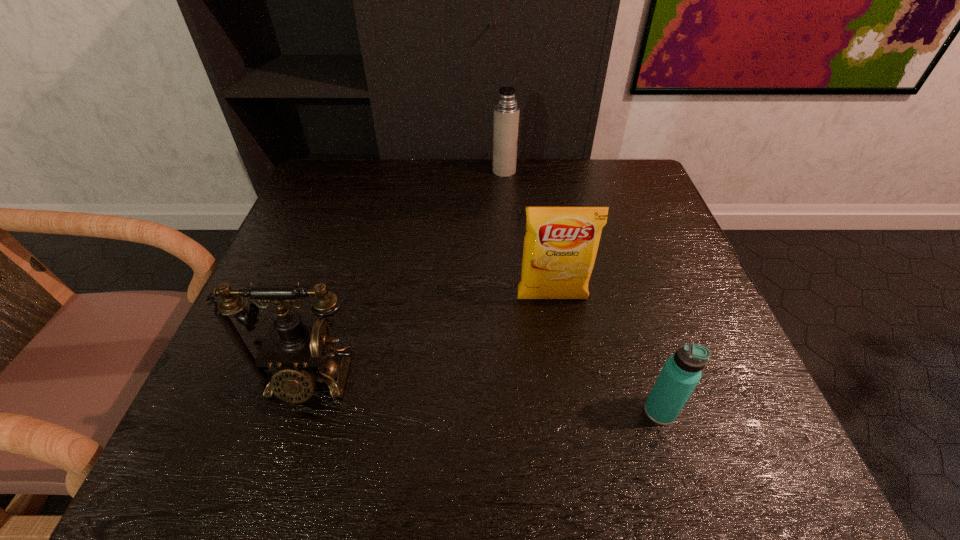
Where is `object that is at the far edge`? The width and height of the screenshot is (960, 540). object that is at the far edge is located at coordinates (506, 111).

The height and width of the screenshot is (540, 960). I want to click on object located in the near edge section of the desktop, so click(x=681, y=372).

Find the location of `object that is at the left edge`. object that is at the left edge is located at coordinates (299, 348).

The width and height of the screenshot is (960, 540). In order to click on object located at the right edge in this screenshot , I will do pos(681,372).

You are a GUI agent. You are given a task and a screenshot of the screen. Output one action in this format:
    pyautogui.click(x=<x>, y=<y>)
    Task: Click on the object present at the near right corner
    This screenshot has width=960, height=540.
    Given the screenshot: What is the action you would take?
    pyautogui.click(x=681, y=372)

Locate an element on the screen. The image size is (960, 540). vacant space at the far edge of the desktop is located at coordinates (489, 193).

Where is `vacant space at the near edge`? vacant space at the near edge is located at coordinates (565, 433).

In the image, there is a desktop. Where is `vacant space at the left edge`? vacant space at the left edge is located at coordinates (219, 422).

Where is `free spot at the far left corner of the desktop`? The height and width of the screenshot is (540, 960). free spot at the far left corner of the desktop is located at coordinates (359, 167).

Where is `vacant space at the far right corner`? This screenshot has width=960, height=540. vacant space at the far right corner is located at coordinates (613, 164).